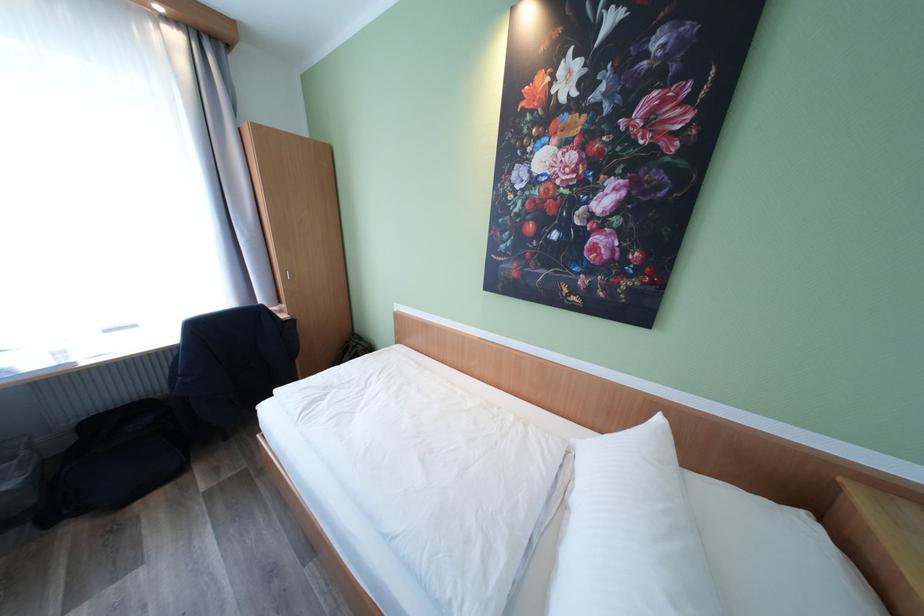
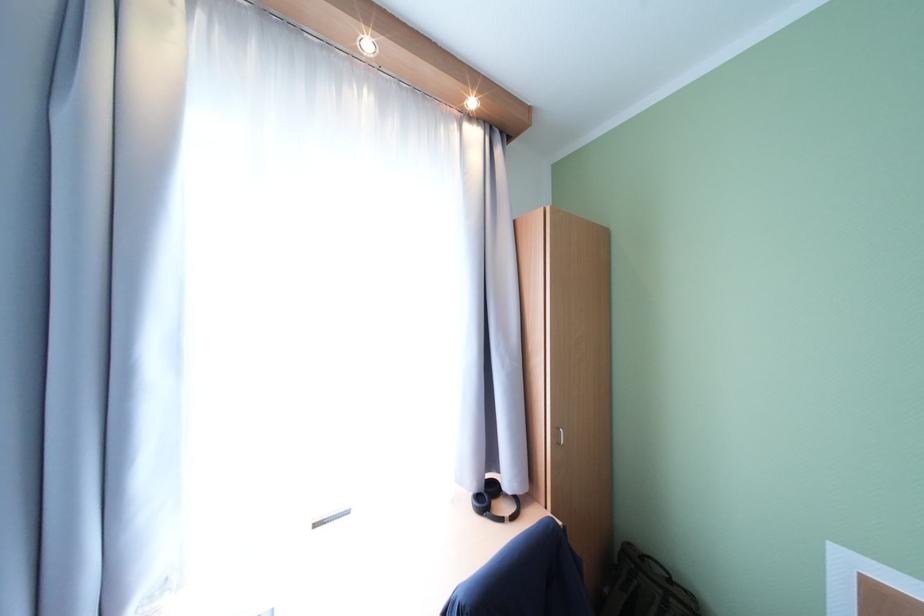
Find the pixel in the second image that matches (365,347) in the first image.

(679, 602)